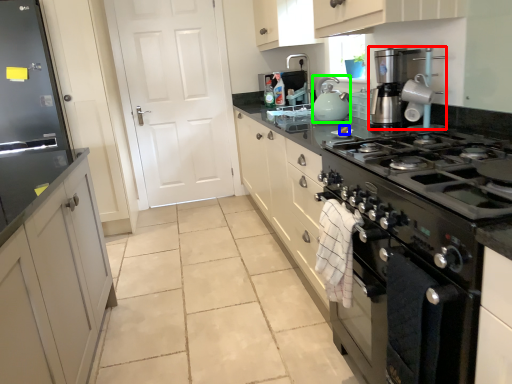
Question: Which object is positioned farthest from home appliance (highlighted by a red box)? Select from food (highlighted by a blue box) and kitchen appliance (highlighted by a green box).

Choices:
 (A) food
 (B) kitchen appliance

Answer: (A)